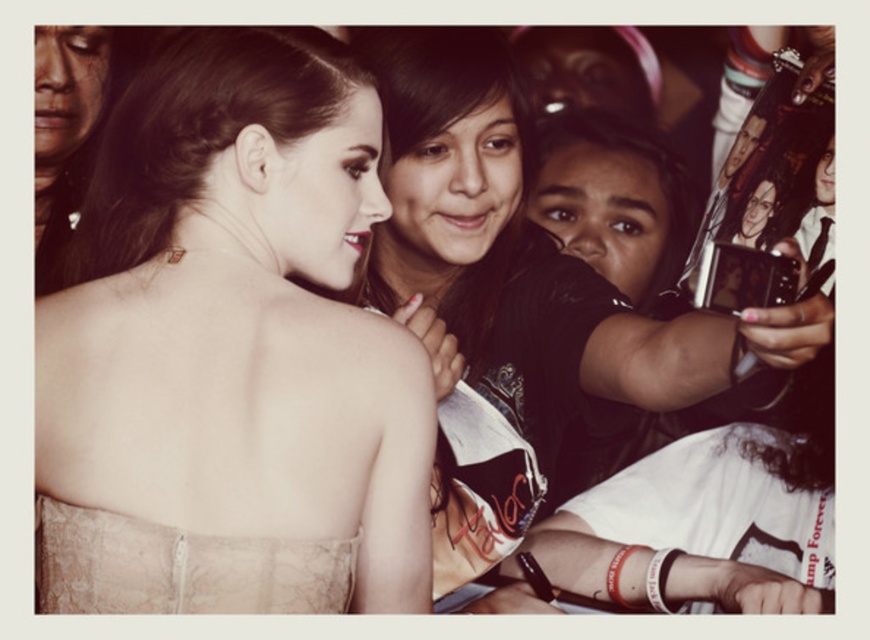
Question: From the image, what is the correct spatial relationship of lace dress at center in relation to matte black dress at center?

Choices:
 (A) below
 (B) above

Answer: (B)

Question: Which of the following is the closest to the observer?

Choices:
 (A) matte black camera at right
 (B) matte black dress at center

Answer: (B)

Question: Considering the relative positions of lace dress at center and matte black camera at right in the image provided, where is lace dress at center located with respect to matte black camera at right?

Choices:
 (A) below
 (B) above

Answer: (A)

Question: Is matte black dress at center to the right of lace fabric dress at center from the viewer's perspective?

Choices:
 (A) yes
 (B) no

Answer: (A)

Question: Which object is positioned closest to the lace dress at center?

Choices:
 (A) matte black dress at center
 (B) lace fabric dress at center
 (C) matte black camera at right

Answer: (B)

Question: Which object is positioned farthest from the matte black dress at center?

Choices:
 (A) lace dress at center
 (B) matte black camera at right
 (C) lace fabric dress at center

Answer: (B)